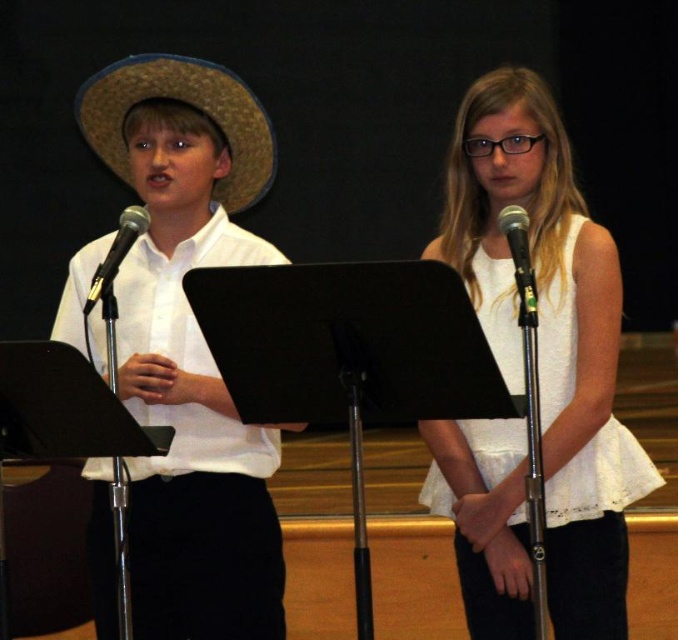
Question: Is white cotton dress at center positioned in front of black metallic microphone at left?

Choices:
 (A) no
 (B) yes

Answer: (A)

Question: Can you confirm if strawhat at left is smaller than black metallic microphone at left?

Choices:
 (A) no
 (B) yes

Answer: (A)

Question: Considering the relative positions of matte straw hat at left and white cotton dress at center in the image provided, where is matte straw hat at left located with respect to white cotton dress at center?

Choices:
 (A) left
 (B) right

Answer: (A)

Question: Which point appears farthest from the camera in this image?

Choices:
 (A) (85, 109)
 (B) (125, 224)
 (C) (523, 564)
 (D) (239, 80)

Answer: (A)

Question: Among these points, which one is nearest to the camera?

Choices:
 (A) (235, 106)
 (B) (233, 465)
 (C) (525, 288)
 (D) (553, 348)

Answer: (C)

Question: Which point appears closest to the camera in this image?

Choices:
 (A) (513, 228)
 (B) (113, 260)

Answer: (A)